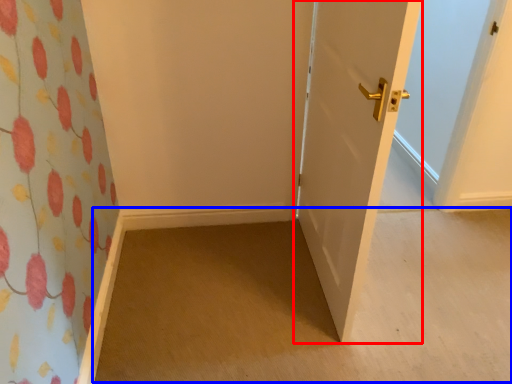
Question: Which point is closer to the camera, door (highlighted by a red box) or plain (highlighted by a blue box)?

Choices:
 (A) door
 (B) plain

Answer: (A)